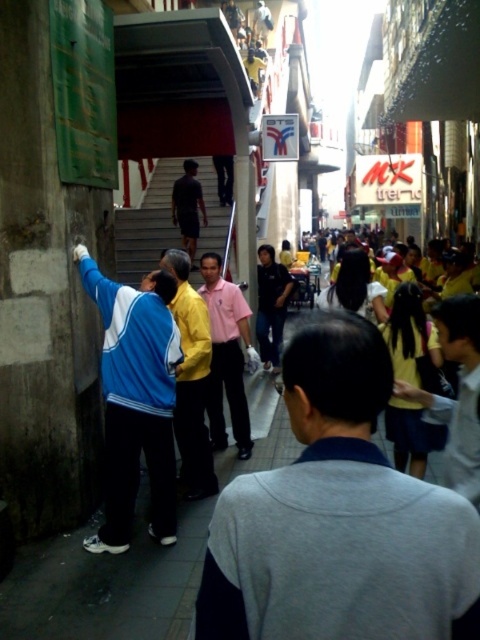
Question: Does blue fabric jacket at left come behind dark matte shirt at center?

Choices:
 (A) yes
 (B) no

Answer: (B)

Question: Based on their relative distances, which object is nearer to the dark matte shirt at center?

Choices:
 (A) yellow matte shirt at center
 (B) gray matte jacket at center
 (C) blue fabric jacket at left

Answer: (A)

Question: Which point appears farthest from the camera in this image?

Choices:
 (A) 177,426
 (B) 216,244

Answer: (B)

Question: Which object appears farthest from the camera in this image?

Choices:
 (A) dark matte shirt at center
 (B) gray matte jacket at center

Answer: (A)

Question: Is blue fabric jacket at left positioned before yellow matte shirt at center?

Choices:
 (A) no
 (B) yes

Answer: (B)

Question: Can you confirm if yellow matte shirt at center is bigger than smooth concrete stairs at center?

Choices:
 (A) yes
 (B) no

Answer: (B)